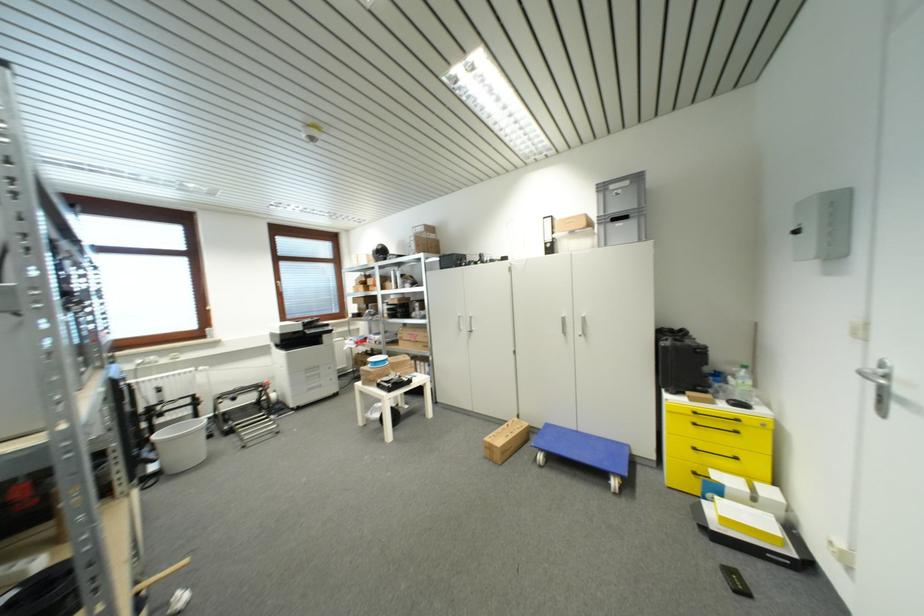
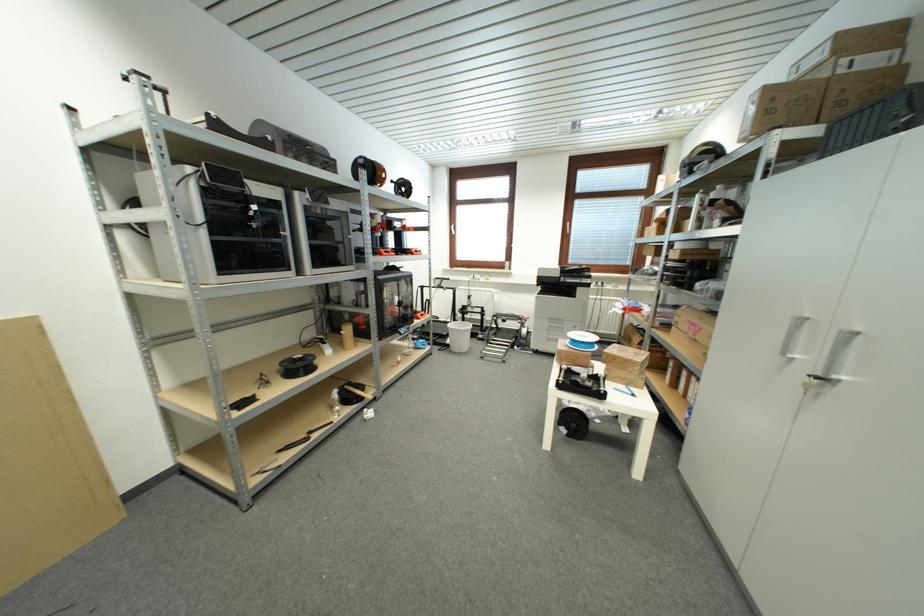
The point at [396,384] is marked in the first image. Where is the corresponding point in the second image?

(578, 381)